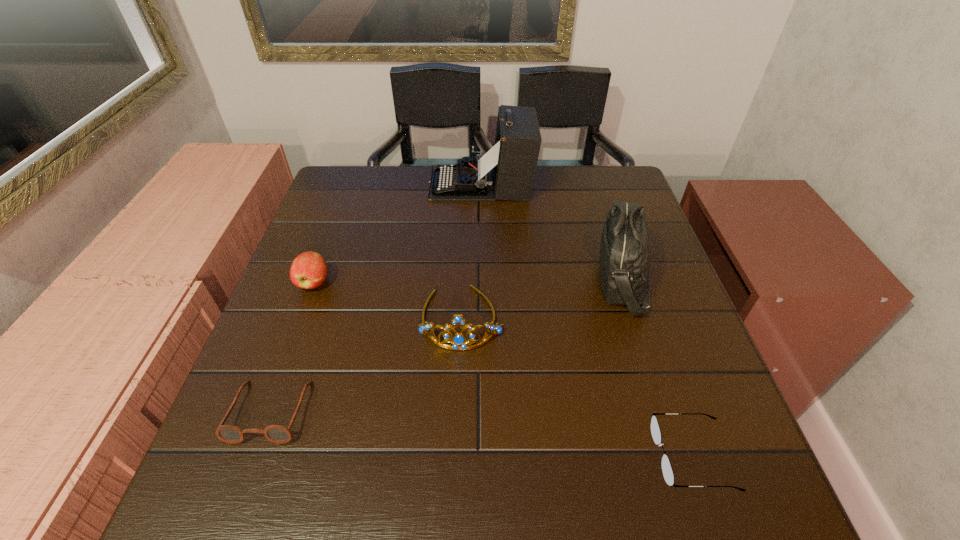
At what (x,y) coordinates should I click in order to perform the action: click on free space at the far left corner of the desktop. Please return your answer as a coordinate pair (x, y). Image resolution: width=960 pixels, height=540 pixels. Looking at the image, I should click on (329, 201).

I want to click on vacant area at the near left corner, so click(227, 486).

The width and height of the screenshot is (960, 540). I want to click on free spot at the near right corner of the desktop, so click(x=750, y=480).

The image size is (960, 540). What are the coordinates of `vacant area that lies between the second tallest object and the fourth shortest object` in the screenshot? It's located at (542, 299).

Find the location of `vacant area that lies between the left spectacles and the apple`. vacant area that lies between the left spectacles and the apple is located at coordinates (292, 347).

This screenshot has height=540, width=960. In order to click on free space between the tiara and the second tallest object in this screenshot , I will do `click(542, 299)`.

Image resolution: width=960 pixels, height=540 pixels. In order to click on vacant space that's between the typewriter and the third shortest object in this screenshot , I will do `click(397, 233)`.

What are the coordinates of `empty location between the shortest object and the third tallest object` in the screenshot? It's located at (577, 387).

In order to click on vacant space that's between the shorter spectacles and the shoulder bag in this screenshot , I will do `click(658, 368)`.

I want to click on free space between the typewriter and the shoulder bag, so click(x=552, y=232).